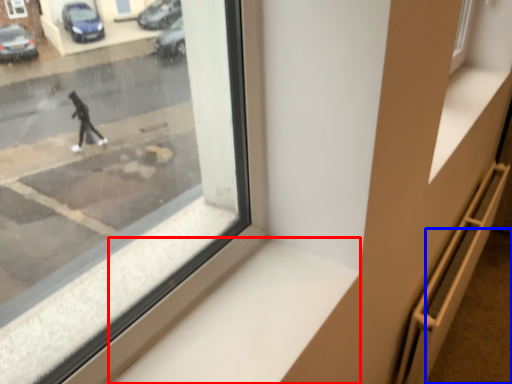
Question: Which point is further to the camera, window sill (highlighted by a red box) or pavement (highlighted by a blue box)?

Choices:
 (A) window sill
 (B) pavement

Answer: (B)